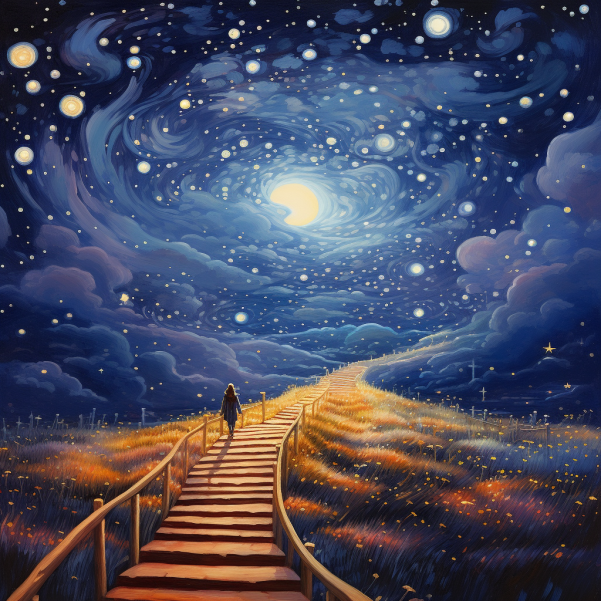
Locate an element on the screen. The width and height of the screenshot is (601, 601). digital style piece of artwork is located at coordinates (319, 309).